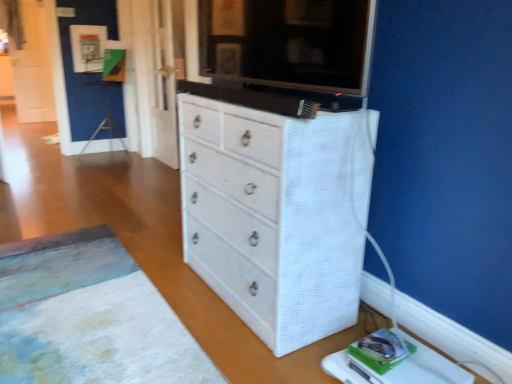
Where is `white textured changing table at lower right`? Image resolution: width=512 pixels, height=384 pixels. white textured changing table at lower right is located at coordinates (398, 368).

The height and width of the screenshot is (384, 512). What do you see at coordinates (398, 368) in the screenshot?
I see `white textured changing table at lower right` at bounding box center [398, 368].

This screenshot has height=384, width=512. Identify the location of white textured rug at lower left. (89, 317).

This screenshot has width=512, height=384. Describe the element at coordinates (89, 317) in the screenshot. I see `white textured rug at lower left` at that location.

The height and width of the screenshot is (384, 512). In order to click on white textured changing table at lower right in this screenshot , I will do `click(398, 368)`.

Is white textured changing table at lower right further to camera compared to white textured cabinet at upper center?

That is False.

Does point (444, 358) appear closer or farther from the camera than point (226, 6)?

Point (444, 358) is closer to the camera than point (226, 6).

Is white textured changing table at lower right spatially inside white textured cabinet at upper center, or outside of it?

white textured changing table at lower right is located beyond the bounds of white textured cabinet at upper center.

From a real-world perspective, does white textured changing table at lower right sit lower than white textured cabinet at upper center?

Yes, from a real-world perspective, white textured changing table at lower right is below white textured cabinet at upper center.

Is white textured chest of drawers at center inside white textured changing table at lower right?

No, white textured chest of drawers at center is not surrounded by white textured changing table at lower right.

This screenshot has width=512, height=384. I want to click on changing table below the white textured chest of drawers at center (from a real-world perspective), so click(398, 368).

Considering the relative sizes of white textured changing table at lower right and white textured chest of drawers at center in the image provided, is white textured changing table at lower right shorter than white textured chest of drawers at center?

Yes.

Consider the image. From the image's perspective, would you say white textured changing table at lower right is positioned over white textured chest of drawers at center?

Actually, white textured changing table at lower right appears below white textured chest of drawers at center in the image.

From a real-world perspective, who is located lower, white textured cabinet at upper center or white textured chest of drawers at center?

In real-world perspective, white textured chest of drawers at center is lower.

In the image, is white textured cabinet at upper center on the left side or the right side of white textured chest of drawers at center?

In the image, white textured cabinet at upper center appears on the left side of white textured chest of drawers at center.

Is white textured cabinet at upper center situated inside white textured chest of drawers at center or outside?

white textured cabinet at upper center is spatially situated outside white textured chest of drawers at center.

Considering the sizes of white textured rug at lower left and white textured cabinet at upper center in the image, is white textured rug at lower left wider or thinner than white textured cabinet at upper center?

Considering their sizes, white textured rug at lower left looks broader than white textured cabinet at upper center.

Is white textured rug at lower left facing towards white textured cabinet at upper center?

No, white textured rug at lower left is not facing towards white textured cabinet at upper center.

From a real-world perspective, which is physically above, white textured rug at lower left or white textured cabinet at upper center?

white textured cabinet at upper center.

Is white textured cabinet at upper center located within white textured rug at lower left?

No, white textured cabinet at upper center is not a part of white textured rug at lower left.

Between white textured chest of drawers at center and white textured changing table at lower right, which one has more height?

white textured chest of drawers at center.

Considering the relative sizes of white textured chest of drawers at center and white textured changing table at lower right in the image provided, is white textured chest of drawers at center thinner than white textured changing table at lower right?

Incorrect, the width of white textured chest of drawers at center is not less than that of white textured changing table at lower right.

Is point (236, 115) more distant than point (418, 374)?

Yes.

Are white textured chest of drawers at center and white textured changing table at lower right located far from each other?

That's not correct — white textured chest of drawers at center is a little close to white textured changing table at lower right.

Relative to white textured changing table at lower right, is white textured rug at lower left in front or behind?

Clearly, white textured rug at lower left is in front of white textured changing table at lower right.

Does point (48, 304) lie behind point (359, 376)?

Yes, point (48, 304) is farther from viewer.

What's the angular difference between white textured rug at lower left and white textured changing table at lower right's facing directions?

180 degrees.

Find the location of `changing table located below the white textured rug at lower left (from the image's perspective)`. changing table located below the white textured rug at lower left (from the image's perspective) is located at coordinates (398, 368).

Considering the relative sizes of white textured rug at lower left and white textured chest of drawers at center in the image provided, is white textured rug at lower left taller than white textured chest of drawers at center?

In fact, white textured rug at lower left may be shorter than white textured chest of drawers at center.

Locate an element on the screen. The height and width of the screenshot is (384, 512). chest of drawers above the white textured rug at lower left (from the image's perspective) is located at coordinates click(x=272, y=217).

Looking at the image, does white textured rug at lower left seem bigger or smaller compared to white textured chest of drawers at center?

Considering their sizes, white textured rug at lower left takes up less space than white textured chest of drawers at center.

Consider the image. From a real-world perspective, which is physically above, white textured rug at lower left or white textured chest of drawers at center?

white textured chest of drawers at center, from a real-world perspective.

I want to click on changing table on the right of white textured cabinet at upper center, so click(398, 368).

At what (x,y) coordinates should I click in order to perform the action: click on changing table below the white textured chest of drawers at center (from a real-world perspective). Please return your answer as a coordinate pair (x, y). Looking at the image, I should click on (398, 368).

Looking at the image, which one is located closer to white textured changing table at lower right, white textured rug at lower left or white textured cabinet at upper center?

Based on the image, white textured rug at lower left appears to be nearer to white textured changing table at lower right.

Looking at the image, which one is located further to white textured chest of drawers at center, white textured changing table at lower right or white textured rug at lower left?

white textured rug at lower left is positioned further to the anchor white textured chest of drawers at center.

From the image, which object appears to be farther from white textured changing table at lower right, white textured cabinet at upper center or white textured chest of drawers at center?

Based on the image, white textured cabinet at upper center appears to be further to white textured changing table at lower right.

Looking at the image, which one is located closer to white textured rug at lower left, white textured cabinet at upper center or white textured changing table at lower right?

white textured changing table at lower right is positioned closer to the anchor white textured rug at lower left.

Consider the image. Which object lies further to the anchor point white textured chest of drawers at center, white textured rug at lower left or white textured cabinet at upper center?

Answer: The object further to white textured chest of drawers at center is white textured rug at lower left.

Looking at the image, which one is located closer to white textured cabinet at upper center, white textured changing table at lower right or white textured rug at lower left?

white textured changing table at lower right.

Which object lies further to the anchor point white textured chest of drawers at center, white textured rug at lower left or white textured changing table at lower right?

Based on the image, white textured rug at lower left appears to be further to white textured chest of drawers at center.

Looking at the image, which one is located closer to white textured chest of drawers at center, white textured changing table at lower right or white textured cabinet at upper center?

Among the two, white textured cabinet at upper center is located nearer to white textured chest of drawers at center.

Locate an element on the screen. The width and height of the screenshot is (512, 384). chest of drawers between white textured rug at lower left and white textured changing table at lower right is located at coordinates (272, 217).

Where is `chest of drawers between white textured cabinet at upper center and white textured rug at lower left in the up-down direction`? The height and width of the screenshot is (384, 512). chest of drawers between white textured cabinet at upper center and white textured rug at lower left in the up-down direction is located at coordinates (272, 217).

At what (x,y) coordinates should I click in order to perform the action: click on chest of drawers between white textured cabinet at upper center and white textured changing table at lower right from top to bottom. Please return your answer as a coordinate pair (x, y). This screenshot has width=512, height=384. Looking at the image, I should click on (272, 217).

Image resolution: width=512 pixels, height=384 pixels. Find the location of `plain between white textured cabinet at upper center and white textured changing table at lower right from top to bottom`. plain between white textured cabinet at upper center and white textured changing table at lower right from top to bottom is located at coordinates (89, 317).